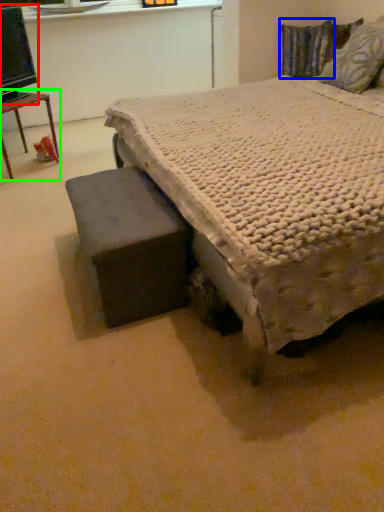
Question: Estimate the real-world distances between objects in this image. Which object is closer to computer monitor (highlighted by a red box), pillow (highlighted by a blue box) or table (highlighted by a green box)?

Choices:
 (A) pillow
 (B) table

Answer: (B)